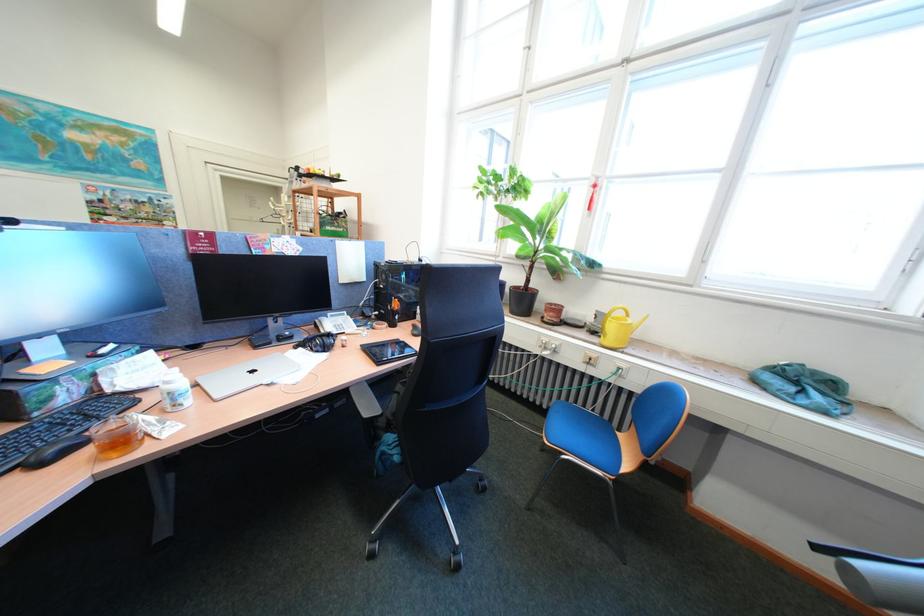
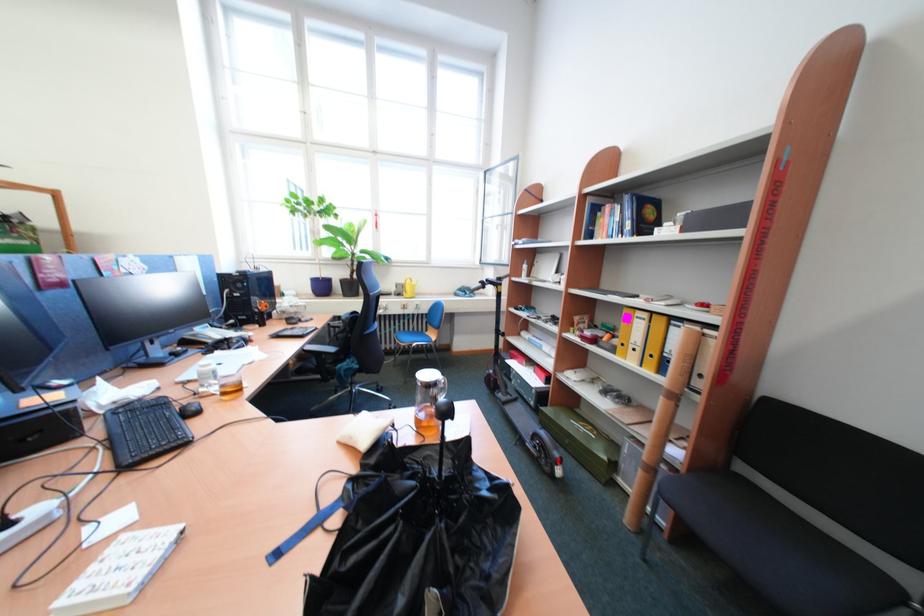
Question: I am providing you with two images of the same scene from different viewpoints. After the viewpoint changes to image2, which objects are now occluded?

Choices:
 (A) pink shoe
 (B) black umbrella handle
 (C) wooden ski
 (D) silver laptop

Answer: (D)